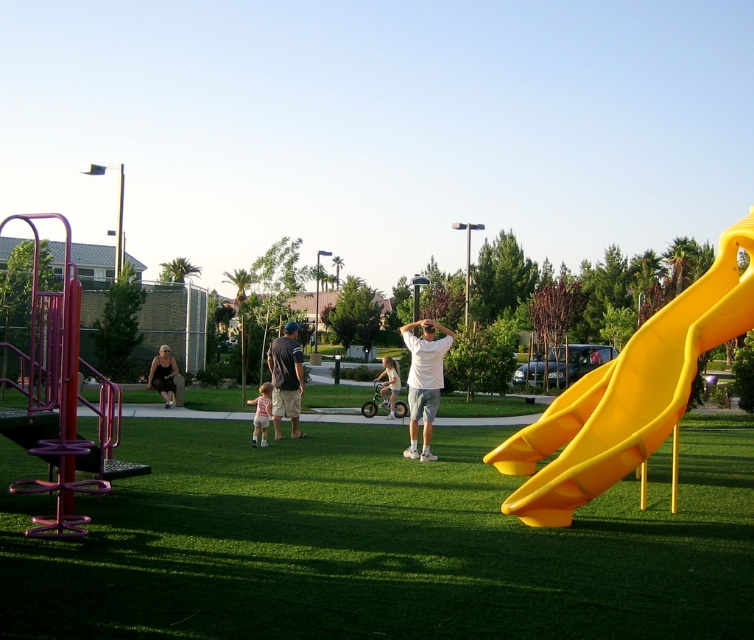
How distant is yellow plastic slide at right from light pink fabric dress at center?

They are 5.53 meters apart.

At what (x,y) coordinates should I click in order to perform the action: click on yellow plastic slide at right. Please return your answer as a coordinate pair (x, y). This screenshot has width=754, height=640. Looking at the image, I should click on (627, 394).

You are a GUI agent. You are given a task and a screenshot of the screen. Output one action in this format:
    pyautogui.click(x=<x>, y=<y>)
    Task: Click on the yellow plastic slide at right
    
    Given the screenshot: What is the action you would take?
    pyautogui.click(x=627, y=394)

Is yellow plastic slide at right closer to the viewer compared to dark gray shirt at center?

Yes, it is in front of dark gray shirt at center.

Is yellow plastic slide at right positioned at the back of dark gray shirt at center?

No, yellow plastic slide at right is in front of dark gray shirt at center.

Who is more distant from viewer, (x=752, y=209) or (x=290, y=371)?

Positioned behind is point (x=290, y=371).

Identify the location of yellow plastic slide at right. The width and height of the screenshot is (754, 640). (627, 394).

Does green artificial turf at center have a greater height compared to dark gray shirt at center?

No.

Looking at this image, does green artificial turf at center have a lesser height compared to dark gray shirt at center?

Correct, green artificial turf at center is not as tall as dark gray shirt at center.

Locate an element on the screen. green artificial turf at center is located at coordinates (377, 541).